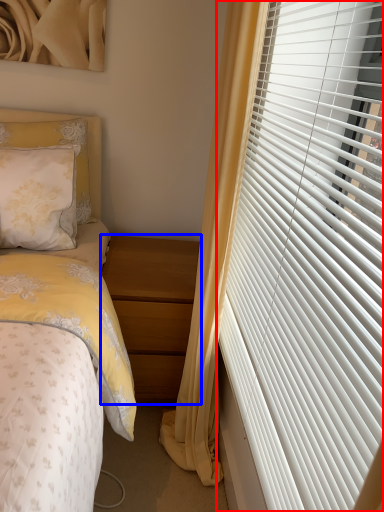
Question: Which object is further to the camera taking this photo, window blind (highlighted by a red box) or nightstand (highlighted by a blue box)?

Choices:
 (A) window blind
 (B) nightstand

Answer: (B)